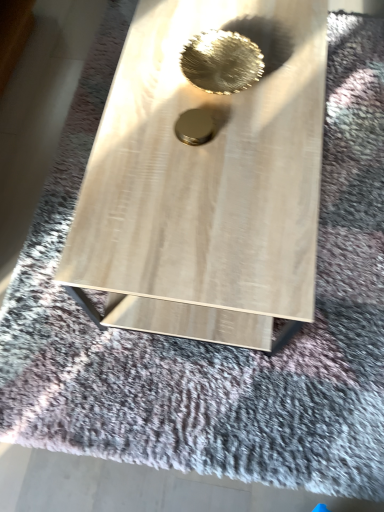
I want to click on free space on the front side of metallic gold bowl at center, acting as the 2th hole starting from the bottom, so click(x=235, y=137).